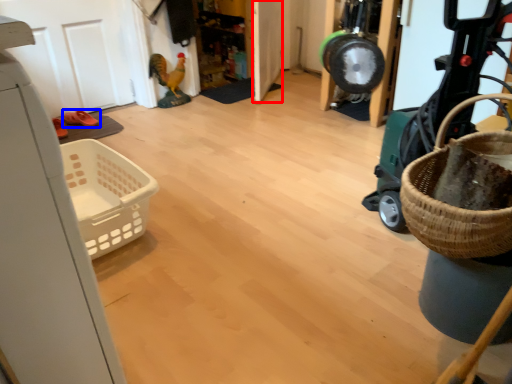
Question: Among these objects, which one is farthest to the camera, door (highlighted by a red box) or footwear (highlighted by a blue box)?

Choices:
 (A) door
 (B) footwear

Answer: (A)